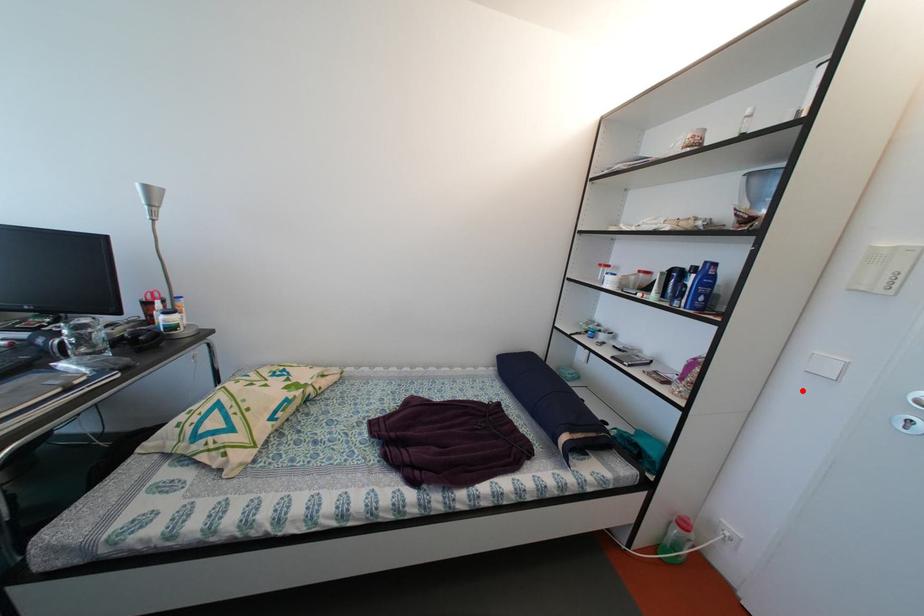
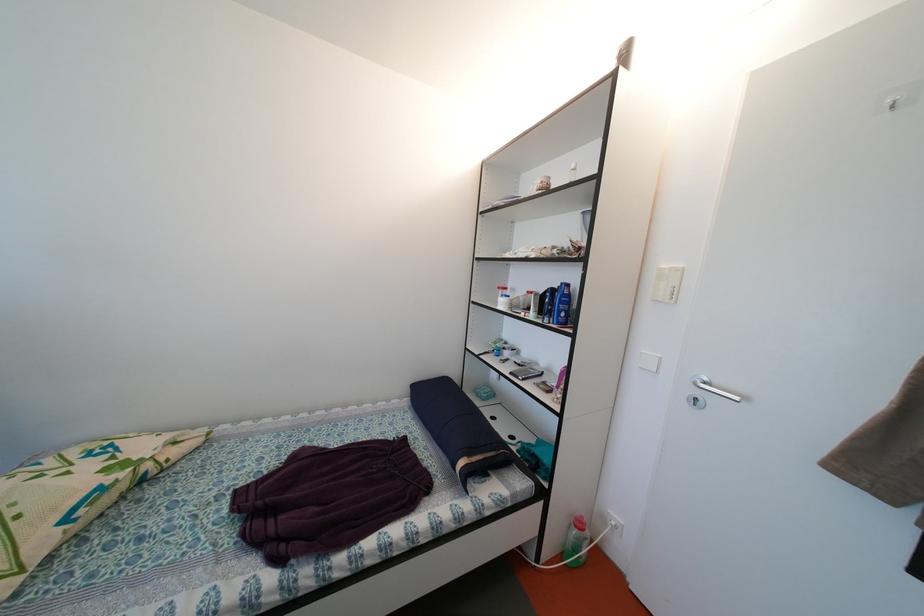
Where in the second image is the point corresponding to the highlighted location from the first image?

(642, 385)